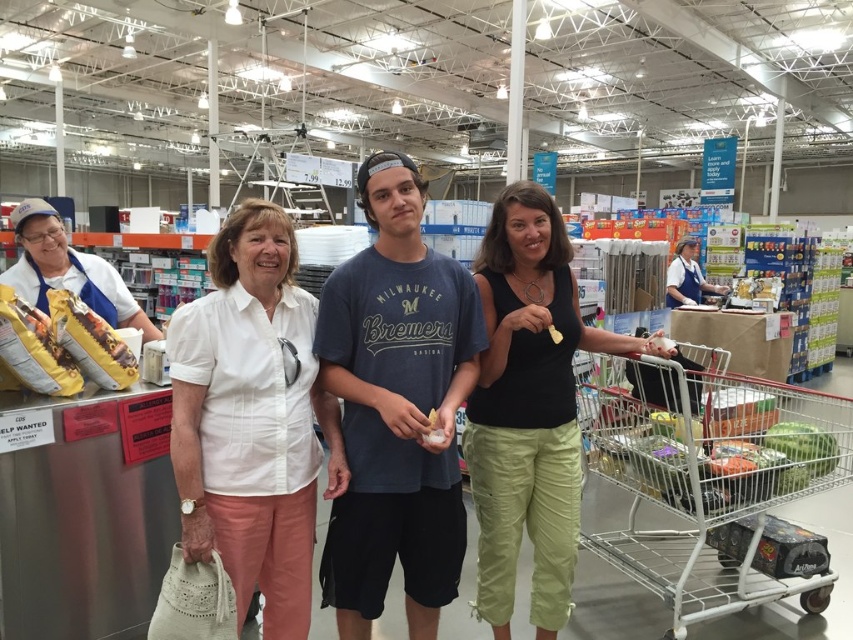
Question: Is white metal shopping cart at lower right thinner than black cotton tank top at center?

Choices:
 (A) no
 (B) yes

Answer: (A)

Question: Which of the following is the closest to the observer?

Choices:
 (A) white cotton shirt at center
 (B) white metal shopping cart at lower right
 (C) black cotton tank top at center
 (D) matte yellow cheese at center

Answer: (D)

Question: Which object is the farthest from the matte yellow cheese at center?

Choices:
 (A) white cotton shirt at center
 (B) white metal shopping cart at lower right
 (C) black cotton tank top at center
 (D) white cotton blouse at center

Answer: (B)

Question: Where is white cotton shirt at center located in relation to white cotton blouse at center in the image?

Choices:
 (A) right
 (B) left

Answer: (A)

Question: Which is nearer to the white metal shopping cart at lower right?

Choices:
 (A) white cotton blouse at center
 (B) matte yellow cheese at center

Answer: (A)

Question: Does white cotton shirt at center appear over white metal shopping cart at lower right?

Choices:
 (A) yes
 (B) no

Answer: (A)